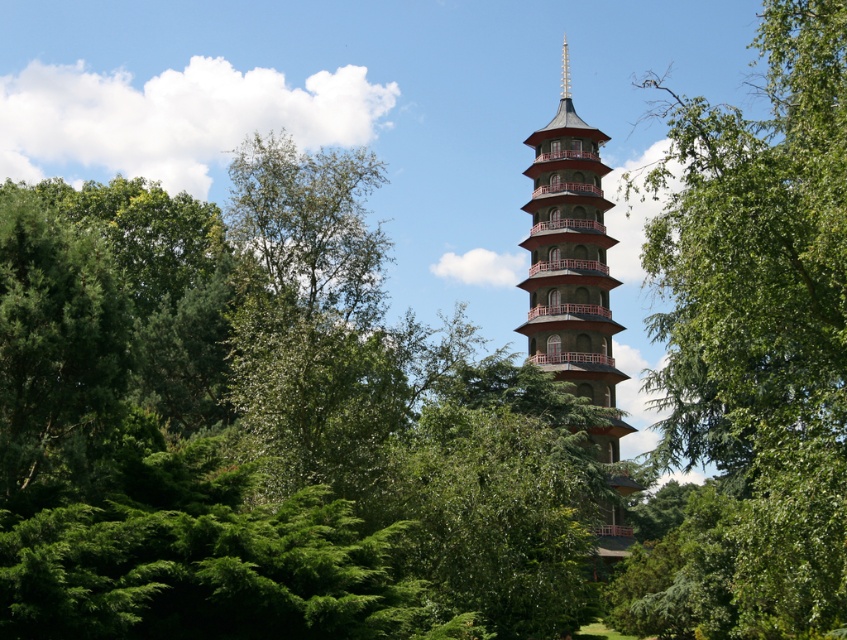
You are standing in front of the pagoda and notice two points marked in the image. The first point is at coordinates point (x=807, y=48) and the second is at point (x=554, y=336). Which point is closer to your current position?

Point (x=807, y=48) is closer to the camera than point (x=554, y=336), so the first point is closer to your current position.

You are a gardener planning to plant a new tree to the right of the green leafy tree at center. Given that the green textured pagoda at center is already present, which object is wider so you know where to place the new tree?

The green leafy tree at center is wider than the green textured pagoda at center, so you should place the new tree to the right of the green leafy tree at center, ensuring enough space between them.